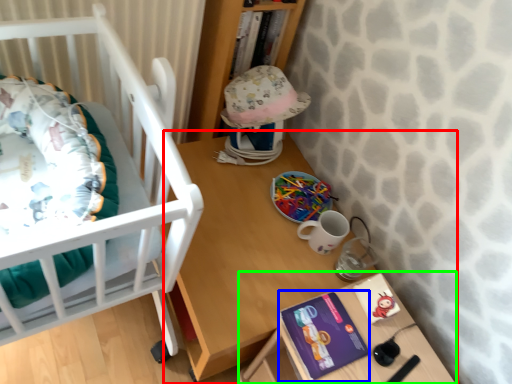
Question: Which is nearer to the table (highlighted by a red box)? paperback book (highlighted by a blue box) or changing table (highlighted by a green box).

Choices:
 (A) paperback book
 (B) changing table

Answer: (B)